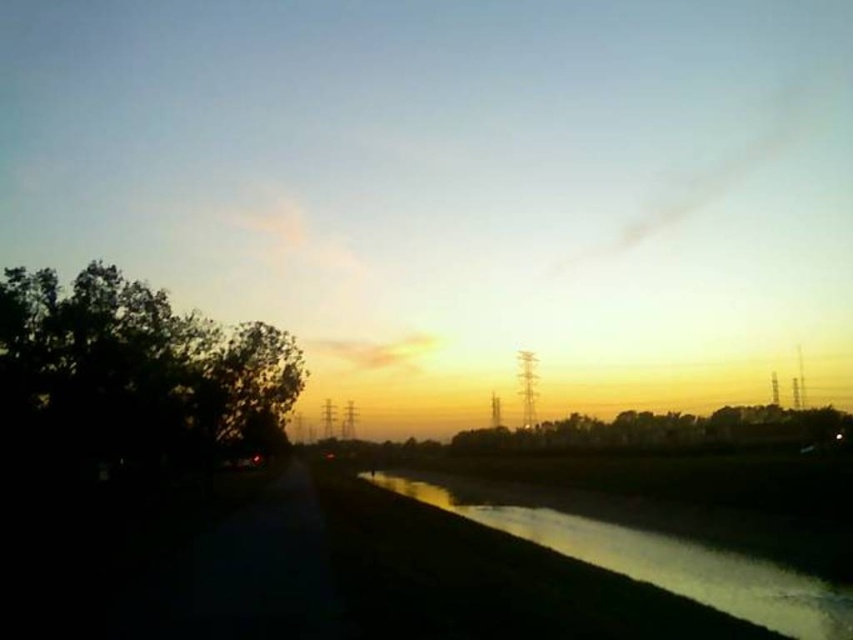
Which is above, dark green leafy tree at left or silvery reflective water at lower right?

dark green leafy tree at left

This screenshot has height=640, width=853. I want to click on dark green leafy tree at left, so click(x=134, y=374).